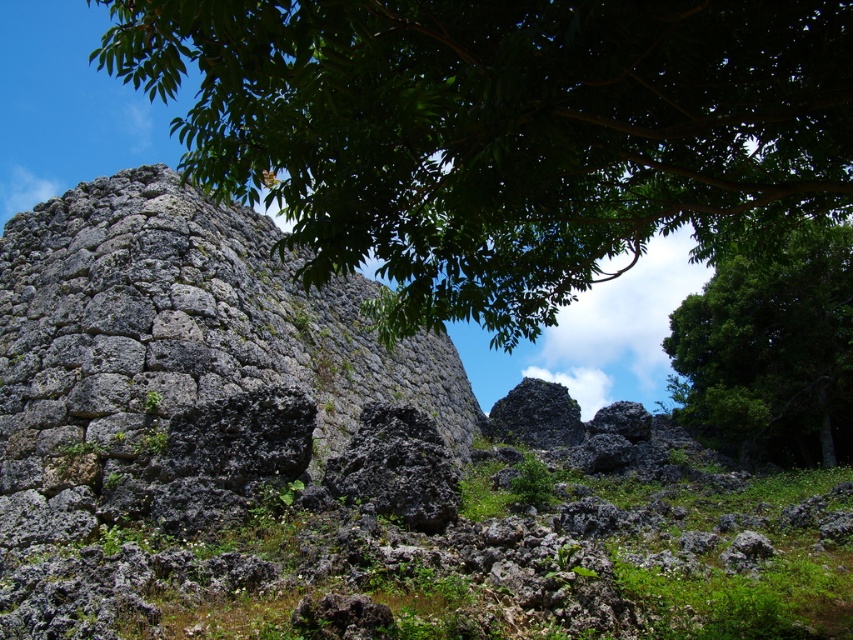
Locate an element on the screen. gray stone wall at center is located at coordinates (343, 461).

Find the location of a particular element. gray stone wall at center is located at coordinates (343, 461).

Who is more forward, (764, 596) or (445, 29)?

Point (445, 29)

Is point (157, 488) more distant than point (824, 168)?

No.

You are a GUI agent. You are given a task and a screenshot of the screen. Output one action in this format:
    pyautogui.click(x=<x>, y=<y>)
    Task: Click on the gray stone wall at center
    The width and height of the screenshot is (853, 640).
    Given the screenshot: What is the action you would take?
    pyautogui.click(x=343, y=461)

Does green leafy tree at upper center appear over green leafy tree at upper right?

Yes, green leafy tree at upper center is above green leafy tree at upper right.

Which is in front, point (274, 179) or point (821, 307)?

Point (274, 179) is more forward.

You are a GUI agent. You are given a task and a screenshot of the screen. Output one action in this format:
    pyautogui.click(x=<x>, y=<y>)
    Task: Click on the green leafy tree at upper center
    This screenshot has height=640, width=853.
    Given the screenshot: What is the action you would take?
    pyautogui.click(x=503, y=132)